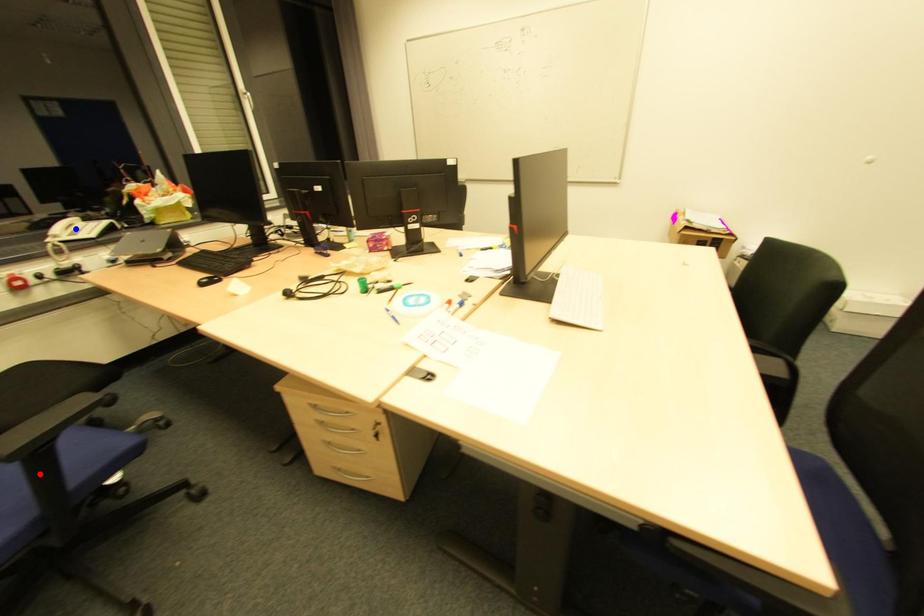
Question: In the image, two points are highlighted. Which point is nearer to the camera? Reply with the corresponding letter.

Choices:
 (A) blue point
 (B) red point

Answer: (B)